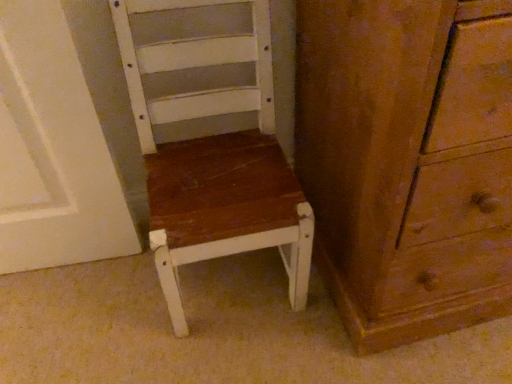
This screenshot has height=384, width=512. I want to click on free region under white wood chair at center (from a real-world perspective), so click(x=232, y=281).